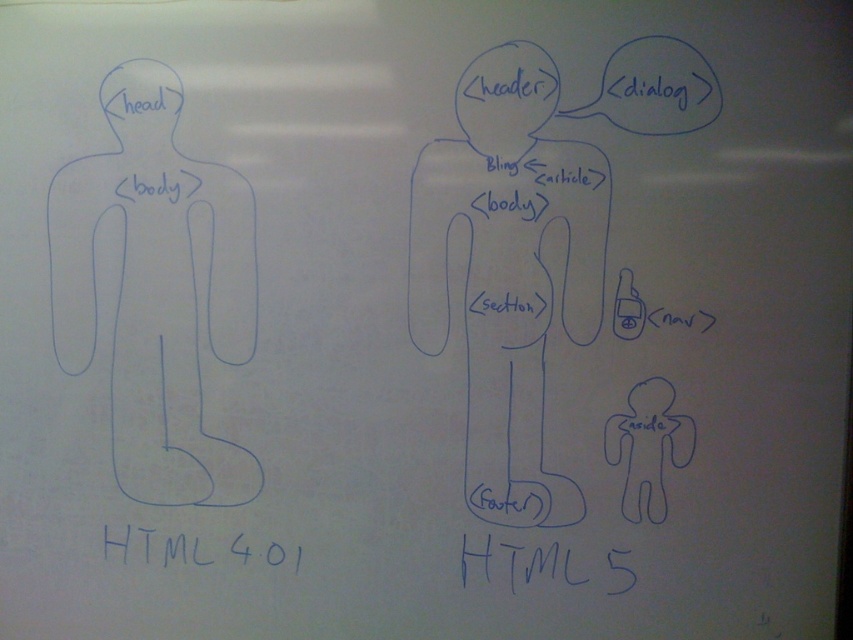
You are standing in front of the whiteboard and see two blue line drawing of body at left and blue line drawing body at center. Which one is positioned to the left side?

The blue line drawing of body at left is positioned to the left of the blue line drawing body at center.

You are standing in front of the whiteboard and see two points marked on the diagram. The first point is at coordinate point (173, 440) and the second is at point (630, 570). Which point is closer to you?

Point (173, 440) is further to the camera than point (630, 570). Therefore, point (630, 570) is closer to you.

You are standing in front of the whiteboard and notice two texts. The first is the black text at lower left, and the second is the blue handwritten text at bottom center. Which text is partially hidden by the other?

The blue handwritten text at bottom center is behind black text at lower left, so it is partially hidden by the black text at lower left.